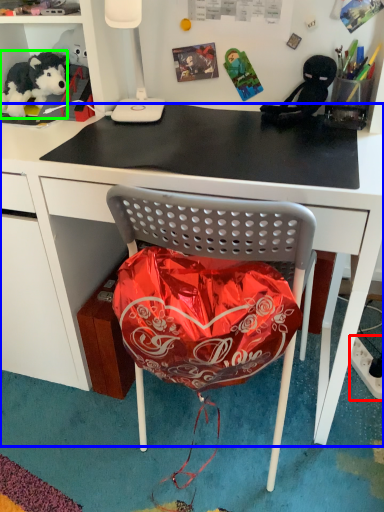
Question: Estimate the real-world distances between objects in this image. Which object is closer to power outlet (highlighted by a red box), desk (highlighted by a blue box) or teddy bear (highlighted by a green box)?

Choices:
 (A) desk
 (B) teddy bear

Answer: (A)